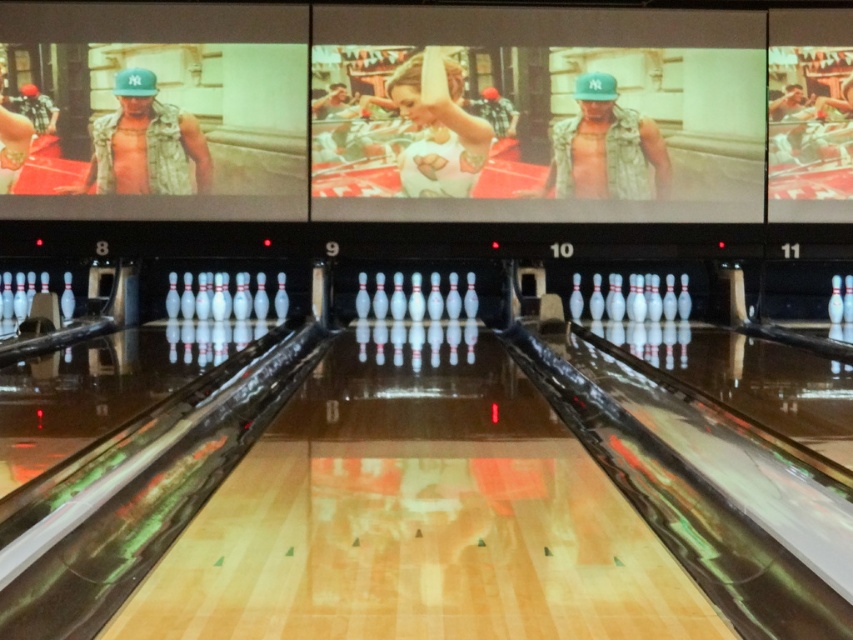
Does camouflage sleeveless shirt at left have a greater width compared to matte black vest at upper left?

Correct, the width of camouflage sleeveless shirt at left exceeds that of matte black vest at upper left.

Is camouflage sleeveless shirt at left bigger than matte black vest at upper left?

Yes.

Does point (177, 177) come closer to viewer compared to point (26, 122)?

No, it is behind (26, 122).

At what (x,y) coordinates should I click in order to perform the action: click on camouflage sleeveless shirt at left. Please return your answer as a coordinate pair (x, y). Looking at the image, I should click on (144, 145).

Is camouflage vest at center bigger than matte black vest at upper left?

Yes.

Find the location of a particular element. Image resolution: width=853 pixels, height=640 pixels. camouflage vest at center is located at coordinates (605, 147).

The width and height of the screenshot is (853, 640). What are the coordinates of `camouflage vest at center` in the screenshot? It's located at (605, 147).

Can you confirm if camouflage sleeveless shirt at left is positioned to the left of camouflage vest at center?

Yes, camouflage sleeveless shirt at left is to the left of camouflage vest at center.

Who is more forward, (164, 109) or (598, 147)?

Positioned in front is point (164, 109).

Identify the location of camouflage sleeveless shirt at left. (144, 145).

The image size is (853, 640). Find the location of `camouflage sleeveless shirt at left`. camouflage sleeveless shirt at left is located at coordinates [144, 145].